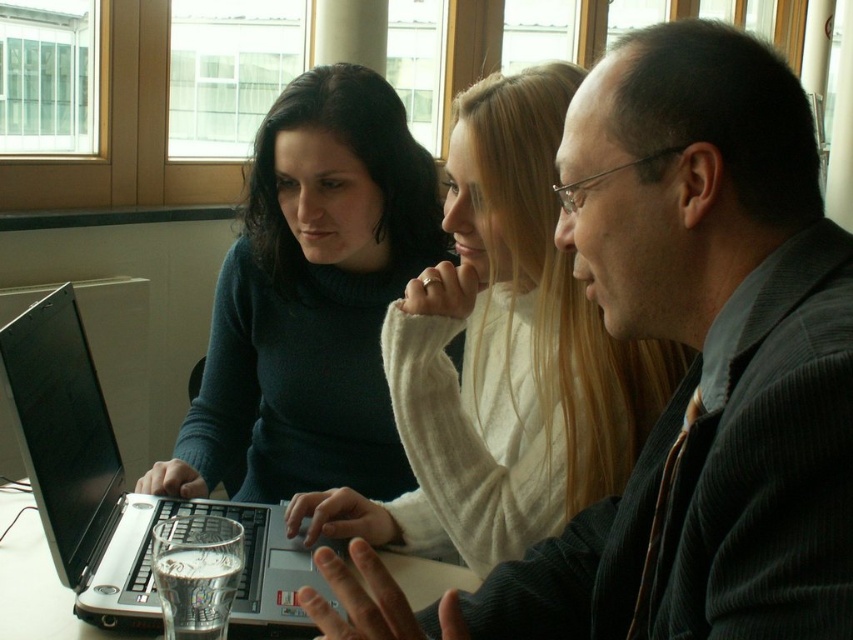
Question: Based on their relative distances, which object is farther from the clear glass table at center?

Choices:
 (A) matte blue sweater at center
 (B) dark gray suit at center
 (C) black glossy laptop at left
 (D) silver metallic laptop at center

Answer: (B)

Question: Does matte blue sweater at center appear on the right side of black glossy laptop at left?

Choices:
 (A) yes
 (B) no

Answer: (A)

Question: Estimate the real-world distances between objects in this image. Which object is farther from the dark gray suit at center?

Choices:
 (A) clear glass table at center
 (B) black glossy laptop at left
 (C) silver metallic laptop at center

Answer: (A)

Question: Can you confirm if black glossy laptop at left is positioned below clear glass table at center?

Choices:
 (A) no
 (B) yes

Answer: (A)

Question: Which is nearer to the clear glass table at center?

Choices:
 (A) matte blue sweater at center
 (B) black glossy laptop at left
 (C) silver metallic laptop at center
 (D) dark gray suit at center

Answer: (C)

Question: Is dark gray suit at center to the left of matte blue sweater at center from the viewer's perspective?

Choices:
 (A) yes
 (B) no

Answer: (B)